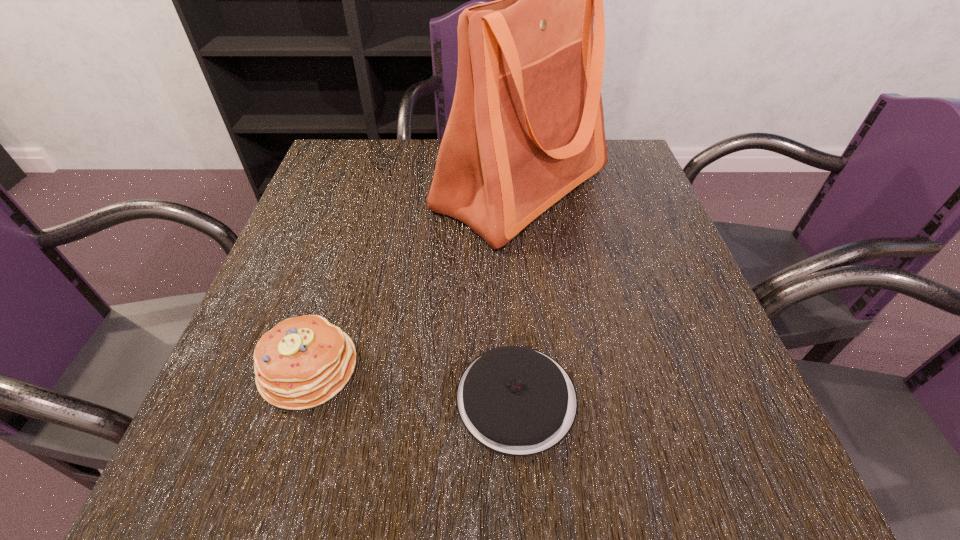
This screenshot has width=960, height=540. I want to click on object present at the near edge, so click(x=516, y=400).

The height and width of the screenshot is (540, 960). In order to click on object that is at the left edge in this screenshot , I will do `click(304, 361)`.

At what (x,y) coordinates should I click in order to perform the action: click on object that is at the right edge. Please return your answer as a coordinate pair (x, y). The width and height of the screenshot is (960, 540). Looking at the image, I should click on (526, 127).

This screenshot has width=960, height=540. In order to click on object located in the far right corner section of the desktop in this screenshot , I will do `click(526, 127)`.

In the image, there is a desktop. Find the location of `vacant space at the far edge`. vacant space at the far edge is located at coordinates (398, 142).

At what (x,y) coordinates should I click in order to perform the action: click on free space at the near edge. Please return your answer as a coordinate pair (x, y). The image size is (960, 540). Looking at the image, I should click on (298, 499).

The width and height of the screenshot is (960, 540). I want to click on free space at the left edge, so [350, 242].

Where is `free space at the right edge of the desktop`? The height and width of the screenshot is (540, 960). free space at the right edge of the desktop is located at coordinates (693, 298).

In the image, there is a desktop. Where is `vacant space at the far left corner`? This screenshot has height=540, width=960. vacant space at the far left corner is located at coordinates (361, 181).

The height and width of the screenshot is (540, 960). In the image, there is a desktop. Identify the location of free space at the near right corner. [732, 469].